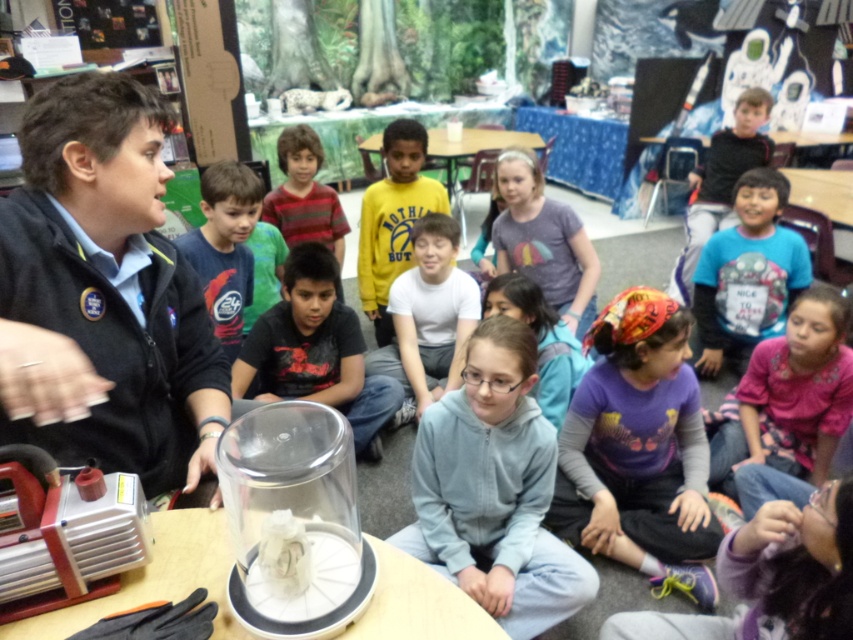
Image resolution: width=853 pixels, height=640 pixels. What are the coordinates of `blue cotton shirt at center` in the screenshot? It's located at (747, 273).

Is point (505, 365) positioned behind point (842, 305)?

No, it is in front of (842, 305).

Does point (447, 490) come behind point (840, 301)?

No, it is in front of (840, 301).

Where is `light blue fleece jacket at center`? This screenshot has width=853, height=640. light blue fleece jacket at center is located at coordinates (494, 490).

Does black sweater at left appear over wooden table at center?

No, black sweater at left is not above wooden table at center.

Is black sweater at left to the left of wooden table at center from the viewer's perspective?

Correct, you'll find black sweater at left to the left of wooden table at center.

Describe the element at coordinates (102, 291) in the screenshot. This screenshot has height=640, width=853. I see `black sweater at left` at that location.

Locate an element on the screen. The image size is (853, 640). black sweater at left is located at coordinates (102, 291).